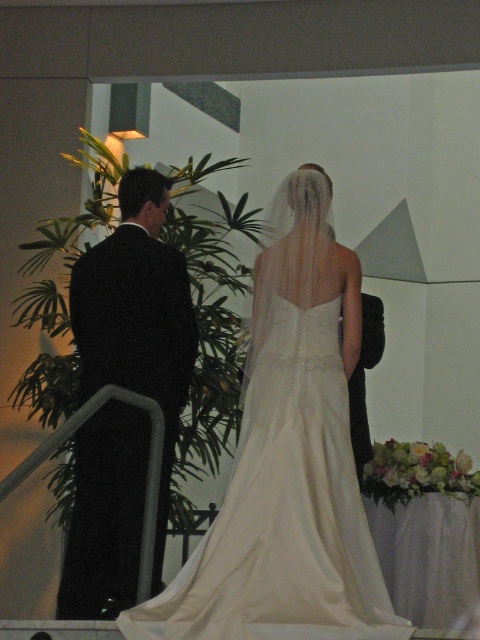
Question: Can you confirm if ivory satin dress at center is smaller than black suit at left?

Choices:
 (A) no
 (B) yes

Answer: (A)

Question: Which of the following is the farthest from the observer?

Choices:
 (A) (290, 339)
 (B) (139, 481)

Answer: (B)

Question: In this image, where is ivory satin dress at center located relative to black suit at left?

Choices:
 (A) left
 (B) right

Answer: (B)

Question: Is ivory satin dress at center smaller than black suit at left?

Choices:
 (A) no
 (B) yes

Answer: (A)